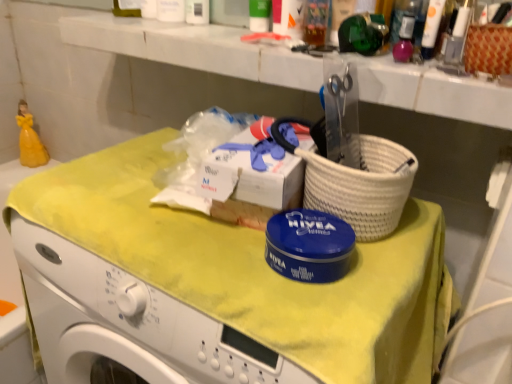
Question: Choose the correct answer: Is woven brown basket at upper right inside yellow fabric at center or outside it?

Choices:
 (A) inside
 (B) outside

Answer: (B)

Question: From their relative heights in the image, would you say woven brown basket at upper right is taller or shorter than yellow fabric at center?

Choices:
 (A) tall
 (B) short

Answer: (B)

Question: Considering the real-world distances, which object is closest to the woven brown basket at upper right?

Choices:
 (A) translucent plastic cup at upper center, the second toiletry viewed from the right
 (B) white glossy counter top at upper center
 (C) white plastic container at upper center, placed as the 3th toiletry when sorted from front to back
 (D) yellow fabric at center
 (E) white glossy tube at upper right, the 1th toiletry when ordered from right to left

Answer: (E)

Question: Considering the real-world distances, which object is closest to the woven brown basket at upper right?

Choices:
 (A) translucent plastic cup at upper center, the 2th toiletry in the front-to-back sequence
 (B) yellow fabric at center
 (C) white glossy tube at upper right, the 3th toiletry in the left-to-right sequence
 (D) white plastic container at upper center, which appears as the 3th toiletry when viewed from the right
 (E) white glossy counter top at upper center

Answer: (C)